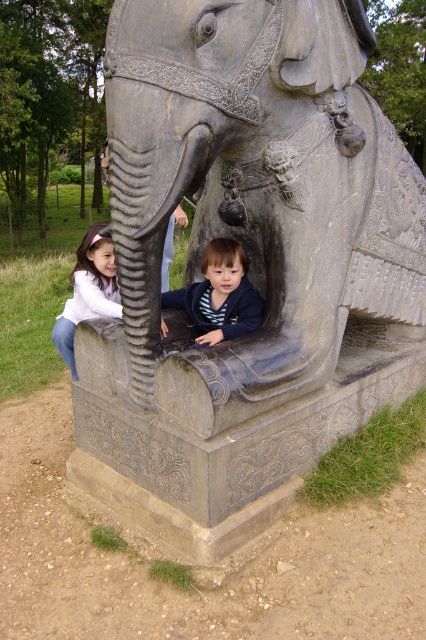
You are a parent trying to take a photo of your child with the gray stone elephant at center and the dark blue fleece at lower center. Which object should you focus on first if you want to capture both in the frame without needing to adjust your camera angle?

The gray stone elephant at center is taller than the dark blue fleece at lower center, so you should focus on the gray stone elephant at center first to ensure it fits in the frame.

You are standing in front of the stone elephant statue and notice two points marked on the statue. The first point is at coordinates point [210,166] and the second is at point [203,326]. Which of these two points is nearer to you?

Point [210,166] is closer to the viewer than point [203,326].